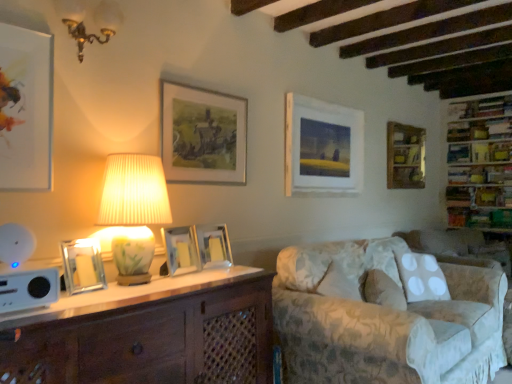
Locate an element on the screen. free space in front of white pleated fabric lampshade at upper left, which appears as the 2th lamp when viewed from the top is located at coordinates (109, 297).